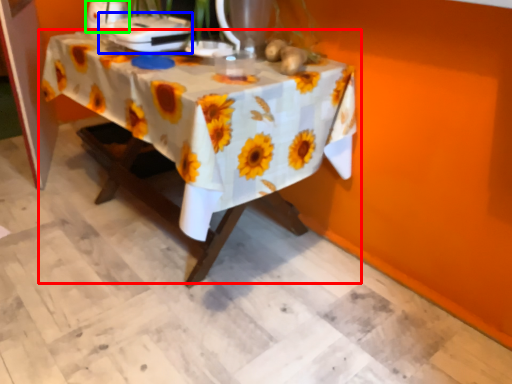
Question: Considering the real-world distances, which object is farthest from table (highlighted by a red box)? appliance (highlighted by a blue box) or appliance (highlighted by a green box)?

Choices:
 (A) appliance
 (B) appliance

Answer: (B)